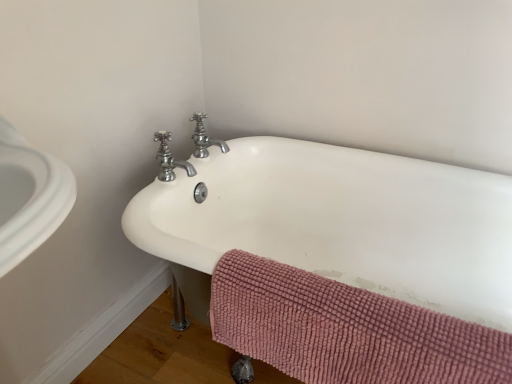
Question: Is polished chrome faucet at upper center, the second tap when ordered from front to back, closer to the viewer compared to polished chrome faucet at upper center, which ranks as the 1th tap in front-to-back order?

Choices:
 (A) yes
 (B) no

Answer: (B)

Question: Does polished chrome faucet at upper center, which appears as the 1th tap when viewed from the back, have a smaller size compared to polished chrome faucet at upper center, arranged as the second tap when viewed from the back?

Choices:
 (A) no
 (B) yes

Answer: (B)

Question: Does polished chrome faucet at upper center, which appears as the 1th tap when viewed from the back, have a lesser width compared to polished chrome faucet at upper center, arranged as the second tap when viewed from the back?

Choices:
 (A) yes
 (B) no

Answer: (A)

Question: Can you confirm if polished chrome faucet at upper center, which appears as the 1th tap when viewed from the back, is positioned to the left of polished chrome faucet at upper center, arranged as the second tap when viewed from the back?

Choices:
 (A) yes
 (B) no

Answer: (B)

Question: From a real-world perspective, is polished chrome faucet at upper center, which appears as the 1th tap when viewed from the back, located higher than polished chrome faucet at upper center, which ranks as the 1th tap in front-to-back order?

Choices:
 (A) no
 (B) yes

Answer: (B)

Question: Is white ceramic bathtub at center wider or thinner than pink chenille bath towel at lower right?

Choices:
 (A) thin
 (B) wide

Answer: (B)

Question: From their relative heights in the image, would you say white ceramic bathtub at center is taller or shorter than pink chenille bath towel at lower right?

Choices:
 (A) tall
 (B) short

Answer: (A)

Question: From a real-world perspective, is white ceramic bathtub at center physically located above or below pink chenille bath towel at lower right?

Choices:
 (A) below
 (B) above

Answer: (A)

Question: Is white ceramic bathtub at center bigger or smaller than pink chenille bath towel at lower right?

Choices:
 (A) small
 (B) big

Answer: (B)

Question: From a real-world perspective, is pink chenille bath towel at lower right physically located above or below white ceramic bathtub at center?

Choices:
 (A) below
 (B) above

Answer: (B)

Question: From the image's perspective, is pink chenille bath towel at lower right located above or below white ceramic bathtub at center?

Choices:
 (A) above
 (B) below

Answer: (B)

Question: Is pink chenille bath towel at lower right taller or shorter than white ceramic bathtub at center?

Choices:
 (A) tall
 (B) short

Answer: (B)

Question: Relative to white ceramic bathtub at center, is pink chenille bath towel at lower right in front or behind?

Choices:
 (A) front
 (B) behind

Answer: (B)

Question: Considering the positions of polished chrome faucet at upper center, which appears as the 1th tap when viewed from the back, and pink chenille bath towel at lower right in the image, is polished chrome faucet at upper center, which appears as the 1th tap when viewed from the back, taller or shorter than pink chenille bath towel at lower right?

Choices:
 (A) short
 (B) tall

Answer: (A)

Question: From the image's perspective, relative to pink chenille bath towel at lower right, is polished chrome faucet at upper center, which appears as the 1th tap when viewed from the back, above or below?

Choices:
 (A) below
 (B) above

Answer: (B)